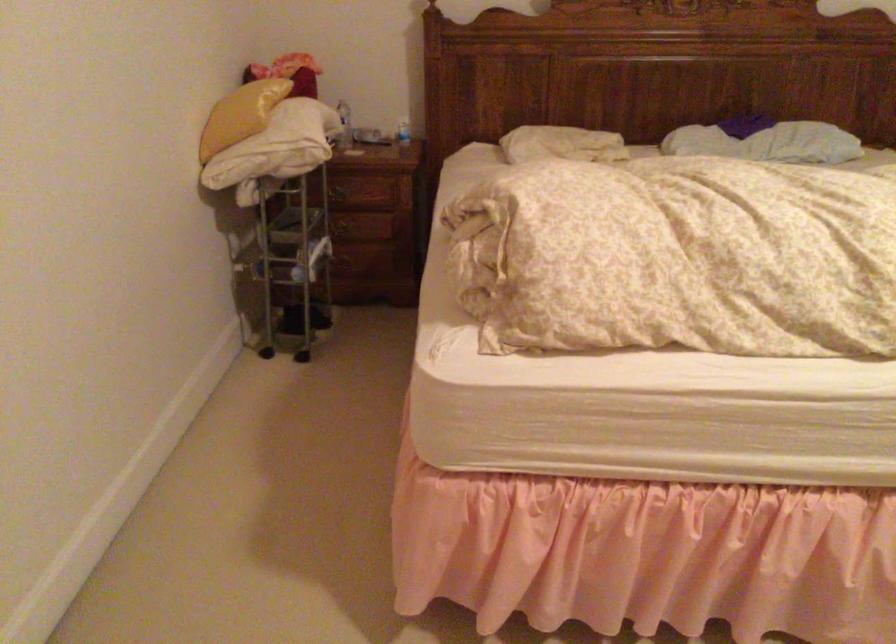
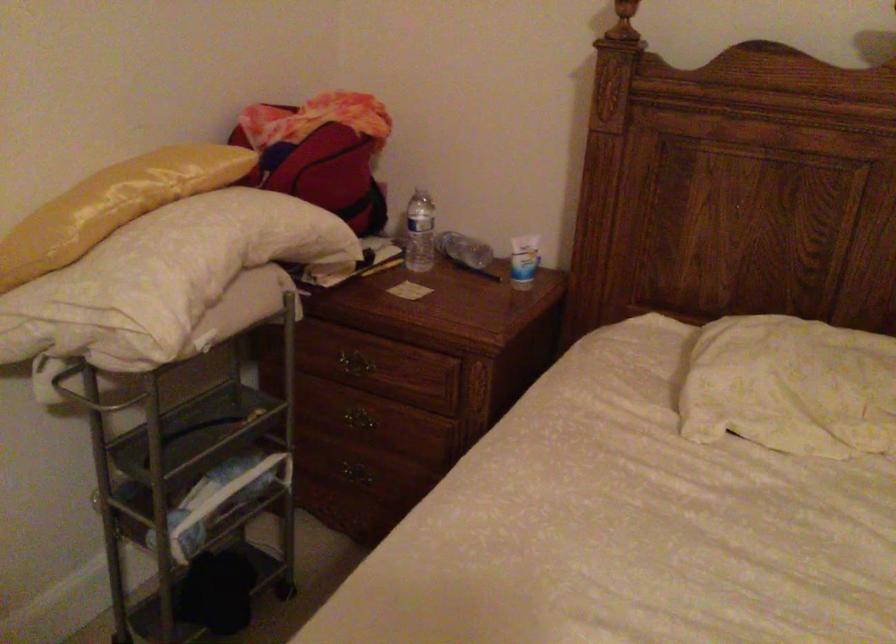
In the second image, find the point that corresponds to pixel 346 232 in the first image.

(357, 426)